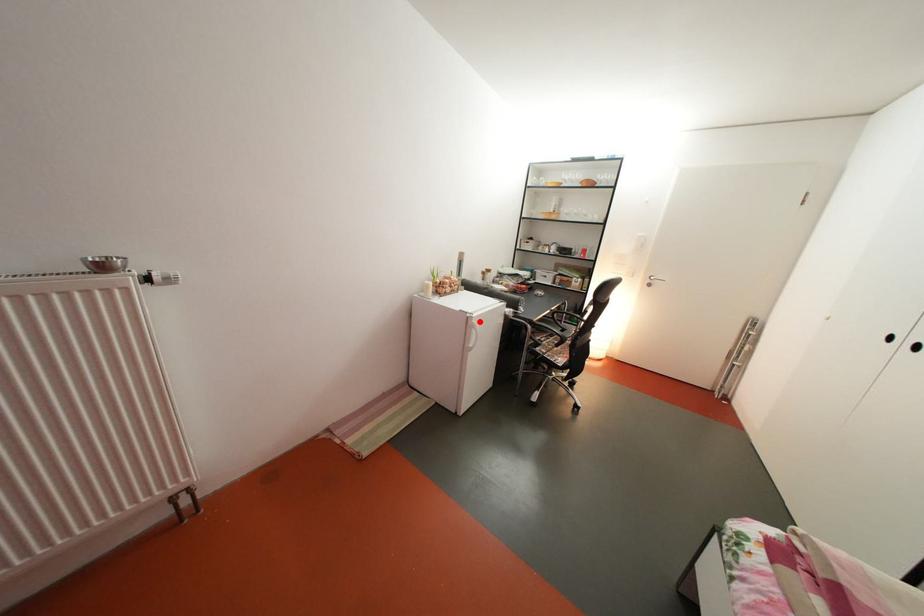
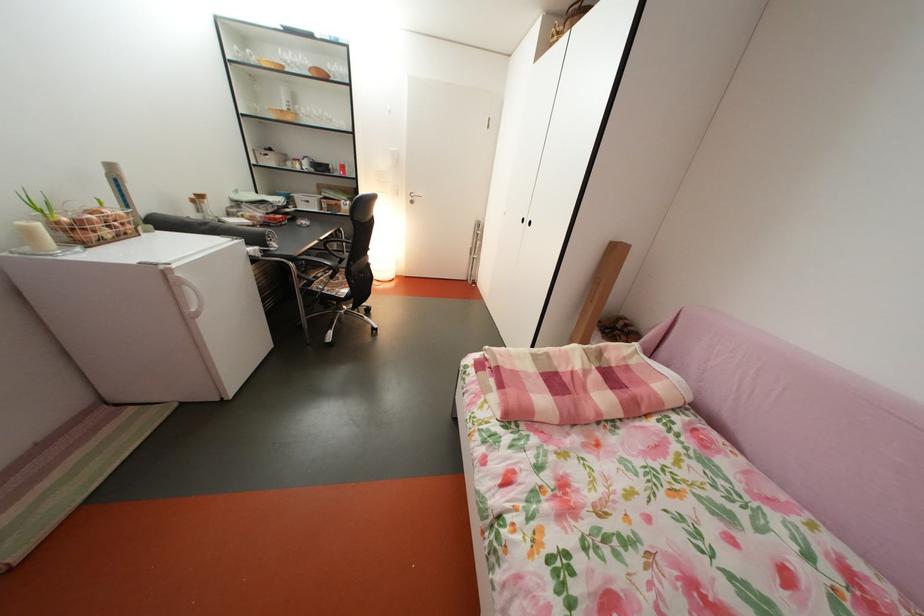
Find the pixel in the second image that matches the highlighted location in the first image.

(174, 274)